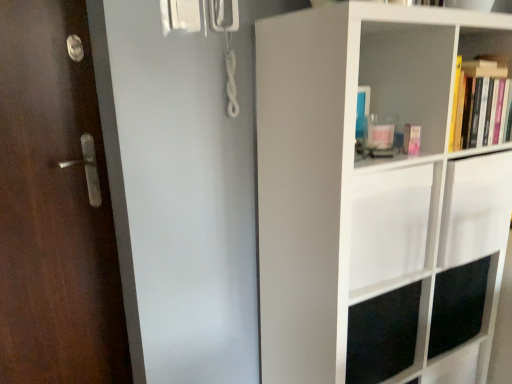
Describe the element at coordinates (378, 195) in the screenshot. I see `white matte shelf at right, positioned as the second shelf in top-to-bottom order` at that location.

This screenshot has width=512, height=384. Identify the location of dark wood door at left. (54, 208).

Is hardcover books at upper right, positioned as the 1th shelf in top-to-bottom order, to the left of dark wood door at left from the viewer's perspective?

Incorrect, hardcover books at upper right, positioned as the 1th shelf in top-to-bottom order, is not on the left side of dark wood door at left.

Is hardcover books at upper right, positioned as the 2th shelf in bottom-to-top order, facing towards dark wood door at left?

No, hardcover books at upper right, positioned as the 2th shelf in bottom-to-top order, is not oriented towards dark wood door at left.

From the image's perspective, is hardcover books at upper right, positioned as the 2th shelf in bottom-to-top order, on top of dark wood door at left?

Yes, from the image's perspective, hardcover books at upper right, positioned as the 2th shelf in bottom-to-top order, is above dark wood door at left.

Is dark wood door at left oriented away from hardcover books at upper right, positioned as the 2th shelf in bottom-to-top order?

That's not correct — dark wood door at left is not looking away from hardcover books at upper right, positioned as the 2th shelf in bottom-to-top order.

Are dark wood door at left and hardcover books at upper right, positioned as the 1th shelf in top-to-bottom order, beside each other?

dark wood door at left is not next to hardcover books at upper right, positioned as the 1th shelf in top-to-bottom order, and they're not touching.

From the image's perspective, does dark wood door at left appear lower than hardcover books at upper right, positioned as the 2th shelf in bottom-to-top order?

Yes.

Does dark wood door at left have a smaller size compared to hardcover books at upper right, positioned as the 2th shelf in bottom-to-top order?

Incorrect, dark wood door at left is not smaller in size than hardcover books at upper right, positioned as the 2th shelf in bottom-to-top order.

Is the surface of dark wood door at left in direct contact with white matte shelf at right, which ranks as the 1th shelf in bottom-to-top order?

There is a gap between dark wood door at left and white matte shelf at right, which ranks as the 1th shelf in bottom-to-top order.

Does dark wood door at left have a lesser width compared to white matte shelf at right, positioned as the second shelf in top-to-bottom order?

Indeed, dark wood door at left has a lesser width compared to white matte shelf at right, positioned as the second shelf in top-to-bottom order.

Is dark wood door at left at the left side of white matte shelf at right, positioned as the second shelf in top-to-bottom order?

Correct, you'll find dark wood door at left to the left of white matte shelf at right, positioned as the second shelf in top-to-bottom order.

Is white matte shelf at right, which ranks as the 1th shelf in bottom-to-top order, in contact with hardcover books at upper right, positioned as the 1th shelf in top-to-bottom order?

No, white matte shelf at right, which ranks as the 1th shelf in bottom-to-top order, is not with hardcover books at upper right, positioned as the 1th shelf in top-to-bottom order.

Which is farther, (375, 54) or (475, 39)?

The point (475, 39) is behind.

Is white matte shelf at right, which ranks as the 1th shelf in bottom-to-top order, taller than hardcover books at upper right, positioned as the 2th shelf in bottom-to-top order?

Correct, white matte shelf at right, which ranks as the 1th shelf in bottom-to-top order, is much taller as hardcover books at upper right, positioned as the 2th shelf in bottom-to-top order.

Is white matte shelf at right, which ranks as the 1th shelf in bottom-to-top order, behind dark wood door at left?

No, the depth of white matte shelf at right, which ranks as the 1th shelf in bottom-to-top order, is less than that of dark wood door at left.

Looking at this image, is white matte shelf at right, positioned as the second shelf in top-to-bottom order, oriented away from dark wood door at left?

That's not correct — white matte shelf at right, positioned as the second shelf in top-to-bottom order, is not looking away from dark wood door at left.

From a real-world perspective, which is physically below, white matte shelf at right, positioned as the second shelf in top-to-bottom order, or dark wood door at left?

Result: white matte shelf at right, positioned as the second shelf in top-to-bottom order, from a real-world perspective.

From the image's perspective, is white matte shelf at right, positioned as the second shelf in top-to-bottom order, below dark wood door at left?

Yes, from the image's perspective, white matte shelf at right, positioned as the second shelf in top-to-bottom order, is below dark wood door at left.

From a real-world perspective, is hardcover books at upper right, positioned as the 1th shelf in top-to-bottom order, positioned above or below white matte shelf at right, which ranks as the 1th shelf in bottom-to-top order?

hardcover books at upper right, positioned as the 1th shelf in top-to-bottom order, is situated higher than white matte shelf at right, which ranks as the 1th shelf in bottom-to-top order, in the real world.

Locate an element on the screen. shelf directly beneath the hardcover books at upper right, positioned as the 1th shelf in top-to-bottom order (from a real-world perspective) is located at coordinates (378, 195).

Is hardcover books at upper right, positioned as the 1th shelf in top-to-bottom order, positioned with its back to white matte shelf at right, positioned as the second shelf in top-to-bottom order?

Absolutely, hardcover books at upper right, positioned as the 1th shelf in top-to-bottom order, is directed away from white matte shelf at right, positioned as the second shelf in top-to-bottom order.

Find the location of a particular element. door on the left of hardcover books at upper right, positioned as the 2th shelf in bottom-to-top order is located at coordinates (54, 208).

The width and height of the screenshot is (512, 384). I want to click on door below the hardcover books at upper right, positioned as the 1th shelf in top-to-bottom order (from the image's perspective), so click(x=54, y=208).

When comparing their distances from white matte shelf at right, which ranks as the 1th shelf in bottom-to-top order, does hardcover books at upper right, positioned as the 2th shelf in bottom-to-top order, or dark wood door at left seem closer?

hardcover books at upper right, positioned as the 2th shelf in bottom-to-top order, is closer to white matte shelf at right, which ranks as the 1th shelf in bottom-to-top order.

Which object lies further to the anchor point dark wood door at left, hardcover books at upper right, positioned as the 1th shelf in top-to-bottom order, or white matte shelf at right, which ranks as the 1th shelf in bottom-to-top order?

Among the two, hardcover books at upper right, positioned as the 1th shelf in top-to-bottom order, is located further to dark wood door at left.

Considering their positions, is dark wood door at left positioned further to hardcover books at upper right, positioned as the 2th shelf in bottom-to-top order, than white matte shelf at right, positioned as the second shelf in top-to-bottom order?

dark wood door at left lies further to hardcover books at upper right, positioned as the 2th shelf in bottom-to-top order, than the other object.

Which object lies further to the anchor point white matte shelf at right, positioned as the second shelf in top-to-bottom order, dark wood door at left or hardcover books at upper right, positioned as the 2th shelf in bottom-to-top order?

dark wood door at left is positioned further to the anchor white matte shelf at right, positioned as the second shelf in top-to-bottom order.

Looking at the image, which one is located further to dark wood door at left, white matte shelf at right, positioned as the second shelf in top-to-bottom order, or hardcover books at upper right, positioned as the 2th shelf in bottom-to-top order?

hardcover books at upper right, positioned as the 2th shelf in bottom-to-top order.

Based on the photo, from the image, which object appears to be farther from hardcover books at upper right, positioned as the 1th shelf in top-to-bottom order, white matte shelf at right, which ranks as the 1th shelf in bottom-to-top order, or dark wood door at left?

Among the two, dark wood door at left is located further to hardcover books at upper right, positioned as the 1th shelf in top-to-bottom order.

The height and width of the screenshot is (384, 512). I want to click on shelf between dark wood door at left and hardcover books at upper right, positioned as the 1th shelf in top-to-bottom order, from left to right, so click(378, 195).